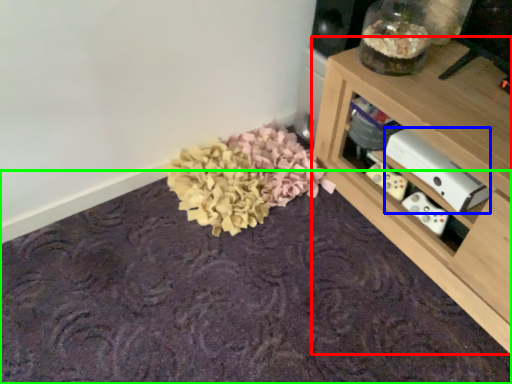
Question: Estimate the real-world distances between objects in this image. Which object is farther from shelf (highlighted by a red box), appliance (highlighted by a blue box) or mat (highlighted by a green box)?

Choices:
 (A) appliance
 (B) mat

Answer: (B)